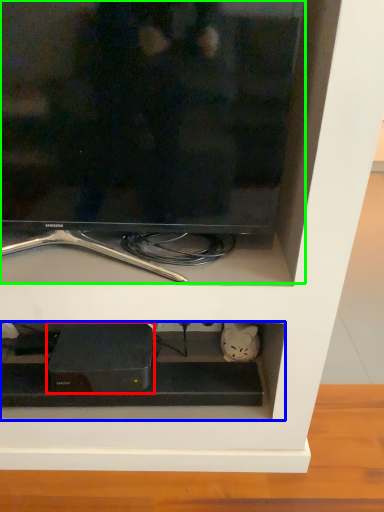
Question: Estimate the real-world distances between objects in this image. Which object is closer to appliance (highlighted by a red box), cabinet (highlighted by a blue box) or television (highlighted by a green box)?

Choices:
 (A) cabinet
 (B) television

Answer: (A)